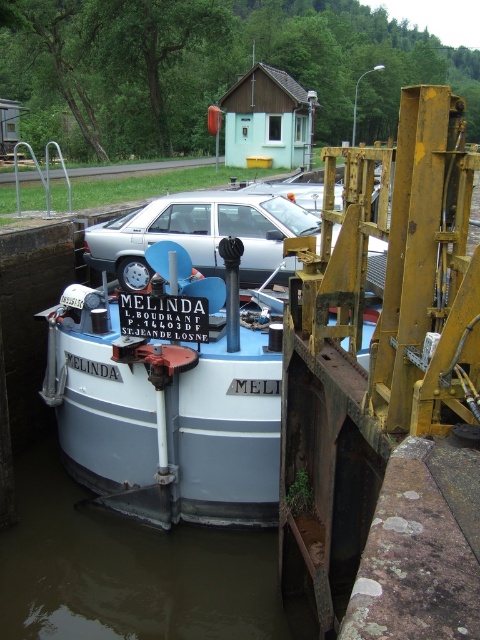
Question: Can you confirm if brown murky water at lower center is positioned to the right of matte silver car at center?

Choices:
 (A) yes
 (B) no

Answer: (B)

Question: Can you confirm if brown murky water at lower center is smaller than matte silver car at center?

Choices:
 (A) no
 (B) yes

Answer: (B)

Question: Which point is closer to the camera?

Choices:
 (A) (241, 276)
 (B) (55, 381)

Answer: (B)

Question: Considering the real-world distances, which object is farthest from the white matte boat at center?

Choices:
 (A) matte silver car at center
 (B) brown murky water at lower center

Answer: (A)

Question: Which of the following is the farthest from the observer?

Choices:
 (A) brown murky water at lower center
 (B) white matte boat at center

Answer: (B)

Question: Can you confirm if white matte boat at center is positioned to the left of matte silver car at center?

Choices:
 (A) no
 (B) yes

Answer: (B)